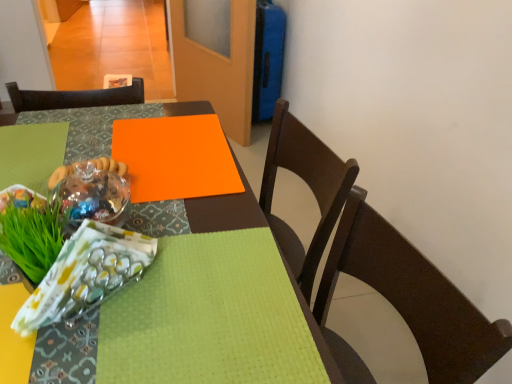
Find the location of a particular element. This screenshot has height=384, width=512. empty space that is ontop of matte orange placemat at center (from a real-world perspective) is located at coordinates (136, 195).